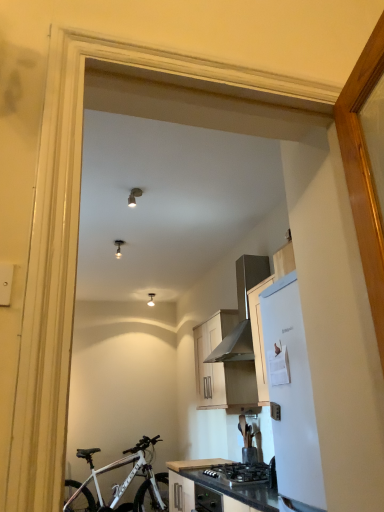
This screenshot has height=512, width=384. I want to click on black granite countertop at lower center, so click(223, 487).

Could white matte refrigerator at right be considered to be inside matte wood cabinet at center?

That's incorrect, white matte refrigerator at right is not inside matte wood cabinet at center.

Can you confirm if matte wood cabinet at center is bigger than white matte refrigerator at right?

Yes.

Can you confirm if matte wood cabinet at center is shorter than white matte refrigerator at right?

Correct, matte wood cabinet at center is not as tall as white matte refrigerator at right.

From the image's perspective, is white matte refrigerator at right above or below black granite countertop at lower center?

From the image's perspective, white matte refrigerator at right appears above black granite countertop at lower center.

Is white matte refrigerator at right aimed at black granite countertop at lower center?

No, white matte refrigerator at right does not turn towards black granite countertop at lower center.

Is white matte refrigerator at right touching black granite countertop at lower center?

No, white matte refrigerator at right is not beside black granite countertop at lower center.

Is white matte refrigerator at right at the right side of black granite countertop at lower center?

Correct, you'll find white matte refrigerator at right to the right of black granite countertop at lower center.

Is matte wood cabinet at center with black granite countertop at lower center?

There is a gap between matte wood cabinet at center and black granite countertop at lower center.

Can you confirm if matte wood cabinet at center is taller than black granite countertop at lower center?

Indeed, matte wood cabinet at center has a greater height compared to black granite countertop at lower center.

In the scene shown: Does matte wood cabinet at center have a lesser width compared to black granite countertop at lower center?

Indeed, matte wood cabinet at center has a lesser width compared to black granite countertop at lower center.

Does matte wood cabinet at center come in front of black granite countertop at lower center?

No, the depth of matte wood cabinet at center is greater than that of black granite countertop at lower center.

Is black granite countertop at lower center situated inside white matte refrigerator at right or outside?

black granite countertop at lower center is outside white matte refrigerator at right.

Is black granite countertop at lower center positioned with its back to white matte refrigerator at right?

No.

Is black granite countertop at lower center to the left of white matte refrigerator at right from the viewer's perspective?

Yes.

From the picture: Considering the sizes of white matte bicycle at lower left and black granite countertop at lower center in the image, is white matte bicycle at lower left bigger or smaller than black granite countertop at lower center?

In the image, white matte bicycle at lower left appears to be larger than black granite countertop at lower center.

From the image's perspective, which is above, white matte bicycle at lower left or black granite countertop at lower center?

black granite countertop at lower center, from the image's perspective.

Consider the image. From a real-world perspective, is white matte bicycle at lower left physically located above or below black granite countertop at lower center?

Clearly, from a real-world perspective, white matte bicycle at lower left is below black granite countertop at lower center.

Which is farther, [87,451] or [252,484]?

Point [87,451]

Can white matte bicycle at lower left be found inside matte wood cabinet at center?

No, white matte bicycle at lower left is located outside of matte wood cabinet at center.

You are a GUI agent. You are given a task and a screenshot of the screen. Output one action in this format:
    pyautogui.click(x=<x>, y=<y>)
    Task: Click on the cabinetry lying in front of the white matte bicycle at lower left
    
    Given the screenshot: What is the action you would take?
    pyautogui.click(x=222, y=367)

Which point is more distant from viewer, (237, 403) or (148, 504)?

The point (148, 504) is farther.

Considering the relative sizes of metallic silver range hood at upper right and white matte refrigerator at right in the image provided, is metallic silver range hood at upper right taller than white matte refrigerator at right?

No, metallic silver range hood at upper right is not taller than white matte refrigerator at right.

Is metallic silver range hood at upper right with white matte refrigerator at right?

No, metallic silver range hood at upper right is not in contact with white matte refrigerator at right.

From a real-world perspective, is metallic silver range hood at upper right physically below white matte refrigerator at right?

No, from a real-world perspective, metallic silver range hood at upper right is not beneath white matte refrigerator at right.

Considering the points (247, 337) and (294, 335), which point is in front, point (247, 337) or point (294, 335)?

Positioned in front is point (294, 335).

Find the location of `cabinetry behind the white matte refrigerator at right`. cabinetry behind the white matte refrigerator at right is located at coordinates (222, 367).

Locate an element on the screen. This screenshot has height=512, width=384. countertop below the white matte refrigerator at right (from the image's perspective) is located at coordinates pos(223,487).

Which object lies nearer to the anchor point white matte bicycle at lower left, matte wood cabinet at center or white matte refrigerator at right?

Among the two, matte wood cabinet at center is located nearer to white matte bicycle at lower left.

When comparing their distances from white matte refrigerator at right, does metallic silver range hood at upper right or white matte bicycle at lower left seem further?

white matte bicycle at lower left is positioned further to the anchor white matte refrigerator at right.

Which object lies nearer to the anchor point black granite countertop at lower center, matte wood cabinet at center or white matte bicycle at lower left?

Among the two, matte wood cabinet at center is located nearer to black granite countertop at lower center.

Considering their positions, is white matte refrigerator at right positioned further to matte wood cabinet at center than metallic silver range hood at upper right?

white matte refrigerator at right is positioned further to the anchor matte wood cabinet at center.

Which object lies further to the anchor point metallic silver range hood at upper right, black granite countertop at lower center or matte wood cabinet at center?

black granite countertop at lower center is positioned further to the anchor metallic silver range hood at upper right.

When comparing their distances from white matte bicycle at lower left, does black granite countertop at lower center or matte wood cabinet at center seem closer?

black granite countertop at lower center is closer to white matte bicycle at lower left.

From the image, which object appears to be farther from white matte refrigerator at right, black granite countertop at lower center or white matte bicycle at lower left?

white matte bicycle at lower left is further to white matte refrigerator at right.

Which object lies nearer to the anchor point matte wood cabinet at center, metallic silver range hood at upper right or white matte bicycle at lower left?

Among the two, metallic silver range hood at upper right is located nearer to matte wood cabinet at center.

The image size is (384, 512). What are the coordinates of `cabinetry between white matte refrigerator at right and white matte bicycle at lower left in the front-back direction` in the screenshot? It's located at (222, 367).

Find the location of a particular element. kitchen appliance located between white matte refrigerator at right and white matte bicycle at lower left in the depth direction is located at coordinates (242, 311).

Identify the location of countertop between white matte refrigerator at right and matte wood cabinet at center from front to back. The image size is (384, 512). (223, 487).

Image resolution: width=384 pixels, height=512 pixels. What are the coordinates of `cabinetry between metallic silver range hood at upper right and black granite countertop at lower center vertically` in the screenshot? It's located at (222, 367).